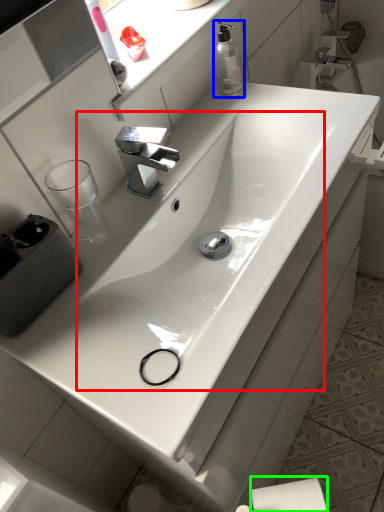
Question: Which is nearer to the sink (highlighted by a red box)? soap dispenser (highlighted by a blue box) or toilet paper (highlighted by a green box).

Choices:
 (A) soap dispenser
 (B) toilet paper

Answer: (A)